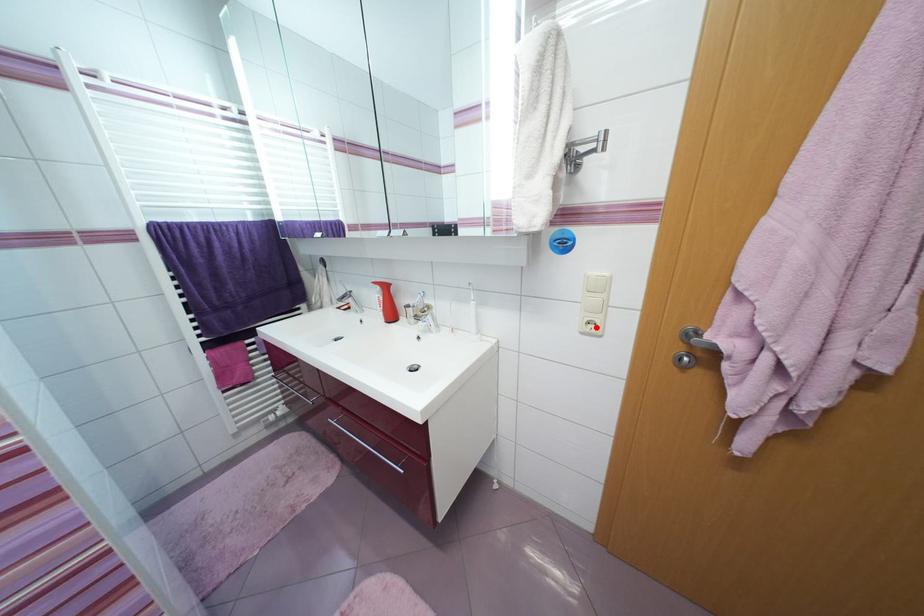
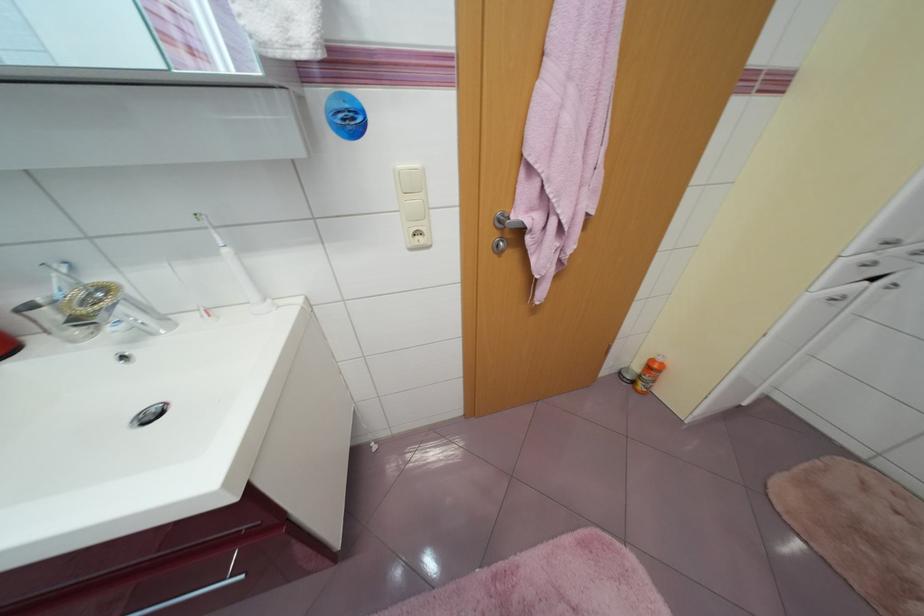
In the second image, find the point that corresponds to the highlighted location in the first image.

(423, 238)